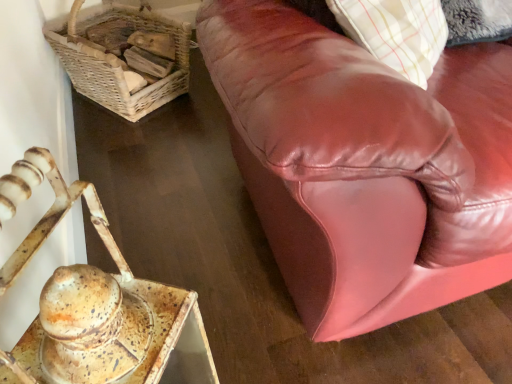
Describe the element at coordinates (365, 165) in the screenshot. The image size is (512, 384). I see `shiny brown leather couch at upper right` at that location.

Identify the location of woven wicker basket at upper left. The width and height of the screenshot is (512, 384). (119, 60).

Locate an element on the screen. Image resolution: width=512 pixels, height=384 pixels. rusty metal tray at lower left is located at coordinates (94, 300).

The width and height of the screenshot is (512, 384). What are the coordinates of `shiny brown leather couch at upper right` in the screenshot? It's located at (365, 165).

Considering the positions of point (120, 254) and point (266, 38), is point (120, 254) closer or farther from the camera than point (266, 38)?

Point (120, 254) is closer to the camera than point (266, 38).

Locate an element on the screen. studio couch that is above the rusty metal tray at lower left (from the image's perspective) is located at coordinates (x=365, y=165).

Looking at this image, can you confirm if rusty metal tray at lower left is wider than shiny brown leather couch at upper right?

Incorrect, the width of rusty metal tray at lower left does not surpass that of shiny brown leather couch at upper right.

Is rusty metal tray at lower left further to the viewer compared to shiny brown leather couch at upper right?

No.

Between point (439, 282) and point (46, 231), which one is positioned behind?

Point (439, 282)

Can you confirm if shiny brown leather couch at upper right is thinner than rusty metal tray at lower left?

Incorrect, the width of shiny brown leather couch at upper right is not less than that of rusty metal tray at lower left.

Is woven wicker basket at upper left turned away from rusty metal tray at lower left?

No, woven wicker basket at upper left is not facing the opposite direction of rusty metal tray at lower left.

Are woven wicker basket at upper left and rusty metal tray at lower left far apart?

Answer: woven wicker basket at upper left is positioned a significant distance from rusty metal tray at lower left.

From a real-world perspective, is woven wicker basket at upper left on top of rusty metal tray at lower left?

Actually, woven wicker basket at upper left is physically below rusty metal tray at lower left in the real world.

Which object is positioned more to the right, woven wicker basket at upper left or rusty metal tray at lower left?

rusty metal tray at lower left.

Is shiny brown leather couch at upper right completely or partially outside of woven wicker basket at upper left?

Yes, shiny brown leather couch at upper right is outside of woven wicker basket at upper left.

Is point (377, 270) positioned in front of point (97, 98)?

Yes, it is.

You are a GUI agent. You are given a task and a screenshot of the screen. Output one action in this format:
    pyautogui.click(x=<x>, y=<y>)
    Task: Click on the studio couch that is in front of the woven wicker basket at upper left
    Image resolution: width=512 pixels, height=384 pixels.
    Given the screenshot: What is the action you would take?
    pyautogui.click(x=365, y=165)

Measure the distance from shiny brown leather couch at upper right to woven wicker basket at upper left.

3.51 feet.

Is rusty metal tray at lower left aimed at woven wicker basket at upper left?

No, rusty metal tray at lower left is not turned towards woven wicker basket at upper left.

Considering the relative positions of rusty metal tray at lower left and woven wicker basket at upper left in the image provided, is rusty metal tray at lower left to the left of woven wicker basket at upper left from the viewer's perspective?

In fact, rusty metal tray at lower left is to the right of woven wicker basket at upper left.

Is rusty metal tray at lower left positioned beyond the bounds of woven wicker basket at upper left?

Indeed, rusty metal tray at lower left is completely outside woven wicker basket at upper left.

The height and width of the screenshot is (384, 512). I want to click on basket located on the left of rusty metal tray at lower left, so click(119, 60).

Are woven wicker basket at upper left and shiny brown leather couch at upper right making contact?

No, woven wicker basket at upper left is not making contact with shiny brown leather couch at upper right.

From the image's perspective, is woven wicker basket at upper left positioned above or below shiny brown leather couch at upper right?

Based on their image positions, woven wicker basket at upper left is located above shiny brown leather couch at upper right.

Is woven wicker basket at upper left at the right side of shiny brown leather couch at upper right?

Incorrect, woven wicker basket at upper left is not on the right side of shiny brown leather couch at upper right.

Who is taller, woven wicker basket at upper left or shiny brown leather couch at upper right?

Standing taller between the two is woven wicker basket at upper left.

At what (x,y) coordinates should I click in order to perform the action: click on furniture in front of the shiny brown leather couch at upper right. Please return your answer as a coordinate pair (x, y). Image resolution: width=512 pixels, height=384 pixels. Looking at the image, I should click on pos(94,300).

The height and width of the screenshot is (384, 512). In order to click on studio couch below the rusty metal tray at lower left (from a real-world perspective) in this screenshot , I will do `click(365, 165)`.

Looking at the image, which one is located further to woven wicker basket at upper left, shiny brown leather couch at upper right or rusty metal tray at lower left?

shiny brown leather couch at upper right lies further to woven wicker basket at upper left than the other object.

When comparing their distances from woven wicker basket at upper left, does rusty metal tray at lower left or shiny brown leather couch at upper right seem closer?

rusty metal tray at lower left.

Based on their spatial positions, is rusty metal tray at lower left or woven wicker basket at upper left closer to shiny brown leather couch at upper right?

The object closer to shiny brown leather couch at upper right is rusty metal tray at lower left.

Based on their spatial positions, is woven wicker basket at upper left or rusty metal tray at lower left further from shiny brown leather couch at upper right?

woven wicker basket at upper left is further to shiny brown leather couch at upper right.

Looking at the image, which one is located further to rusty metal tray at lower left, shiny brown leather couch at upper right or woven wicker basket at upper left?

woven wicker basket at upper left.

When comparing their distances from rusty metal tray at lower left, does woven wicker basket at upper left or shiny brown leather couch at upper right seem closer?

shiny brown leather couch at upper right lies closer to rusty metal tray at lower left than the other object.

Image resolution: width=512 pixels, height=384 pixels. Identify the location of studio couch located between rusty metal tray at lower left and woven wicker basket at upper left in the depth direction. (365, 165).